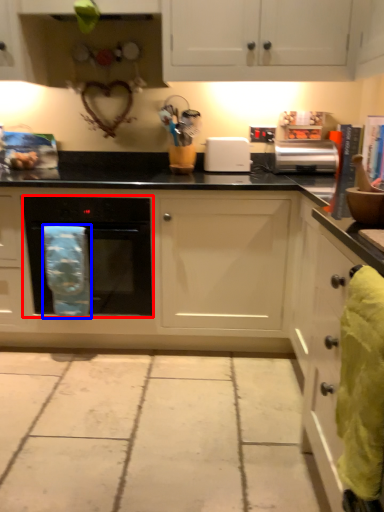
Question: Which object is closer to the camera taking this photo, home appliance (highlighted by a red box) or material (highlighted by a blue box)?

Choices:
 (A) home appliance
 (B) material

Answer: (B)